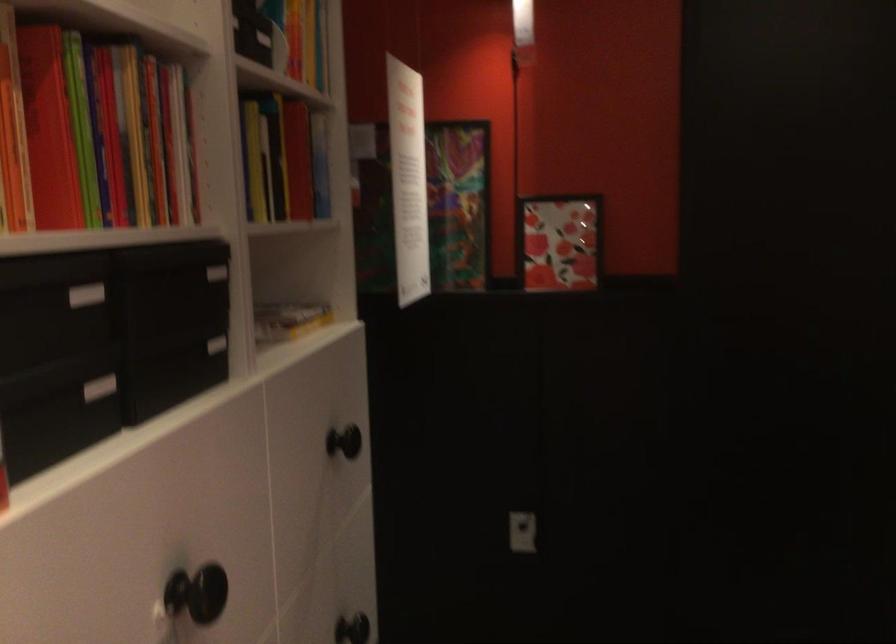
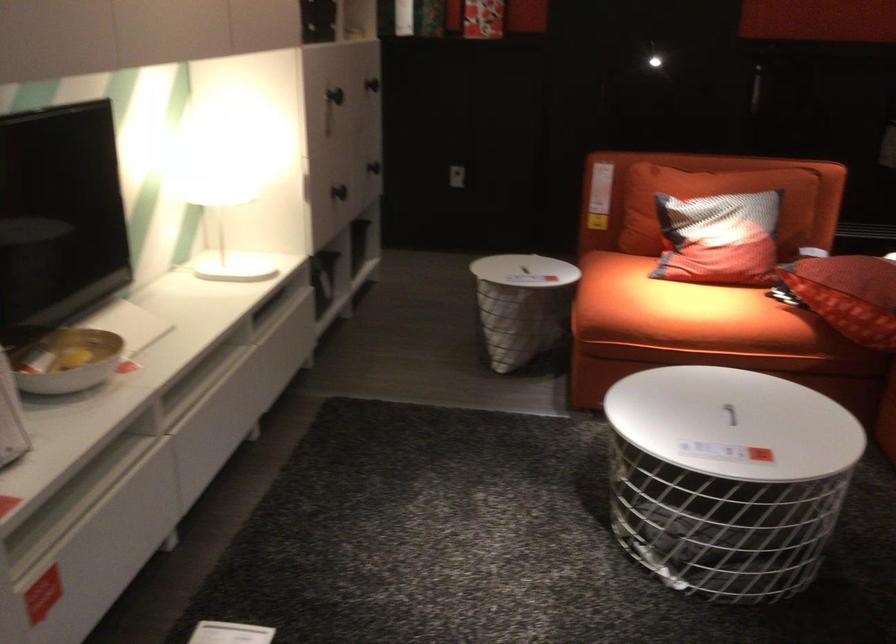
In the second image, find the point that corresponds to the point at 328,471 in the first image.

(372, 84)